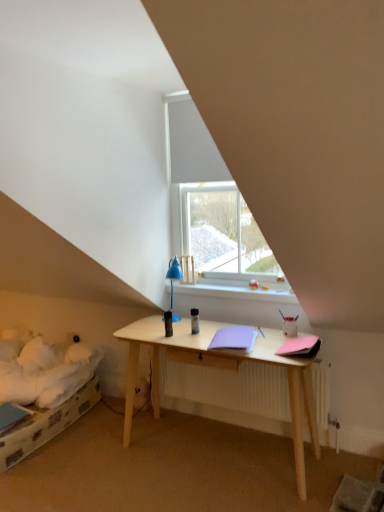
The width and height of the screenshot is (384, 512). Identify the location of free space above white plastic window sill at center (from a real-world perspective). (235, 281).